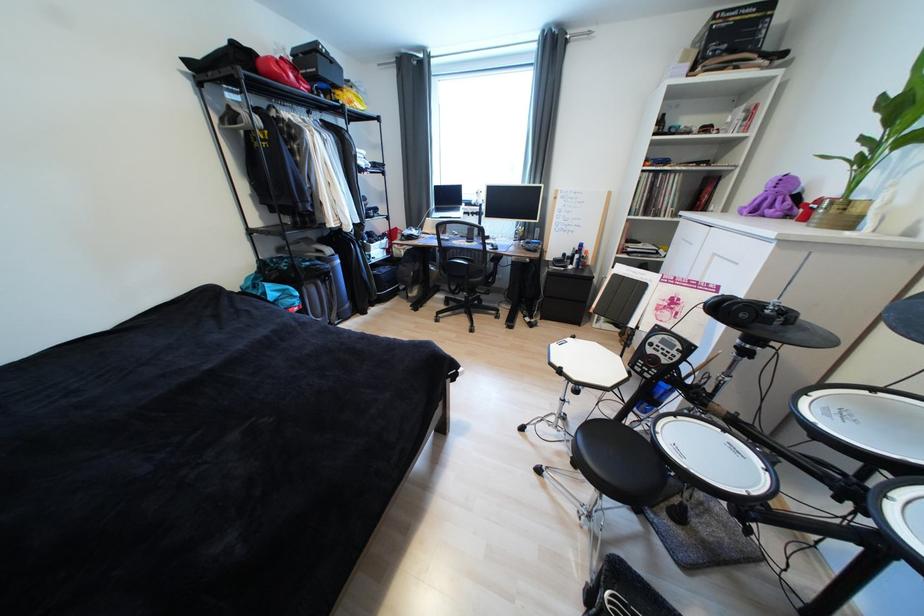
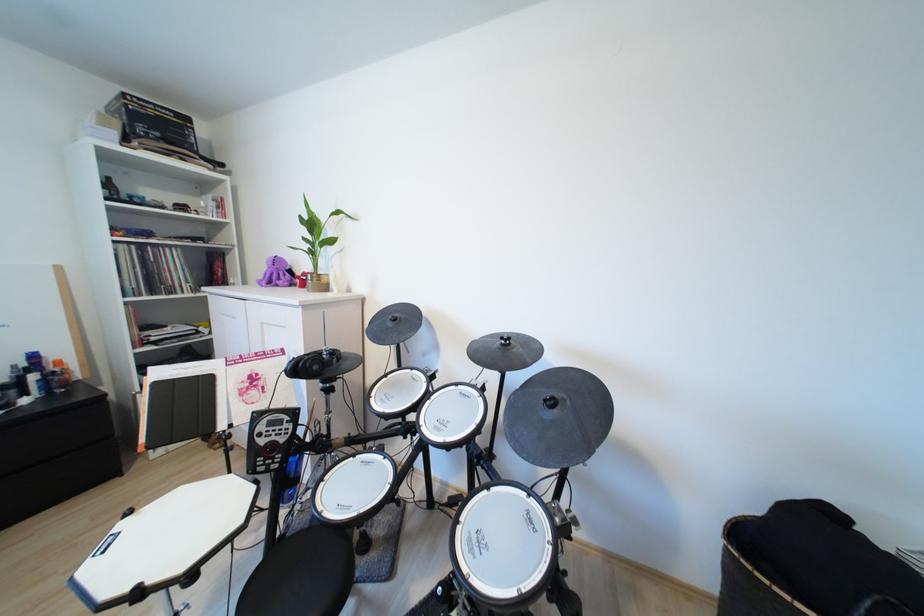
Locate, in the second image, the point that corresponds to point (787, 204) in the first image.

(289, 277)